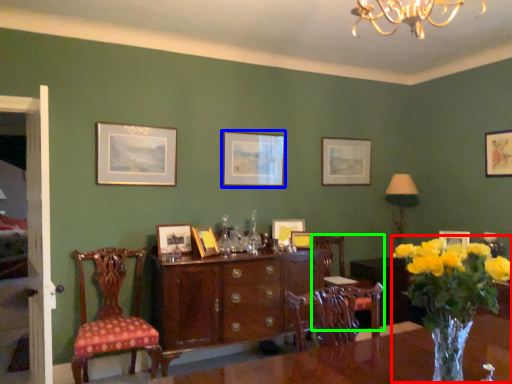
Question: Estimate the real-world distances between objects in this image. Which object is farther from floral arrangement (highlighted by a red box), picture frame (highlighted by a blue box) or chair (highlighted by a green box)?

Choices:
 (A) picture frame
 (B) chair

Answer: (A)